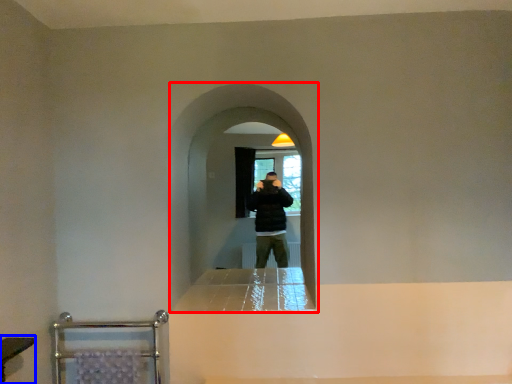
Question: Which object is closer to the camera taking this photo, screen door (highlighted by a red box) or vanity (highlighted by a blue box)?

Choices:
 (A) screen door
 (B) vanity

Answer: (B)